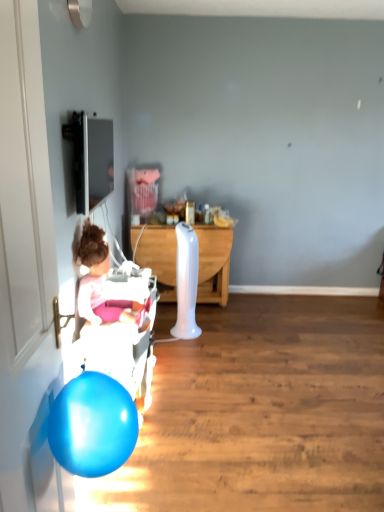
This screenshot has width=384, height=512. I want to click on empty space that is ontop of glossy blue balloon at lower left (from a real-world perspective), so coord(91,387).